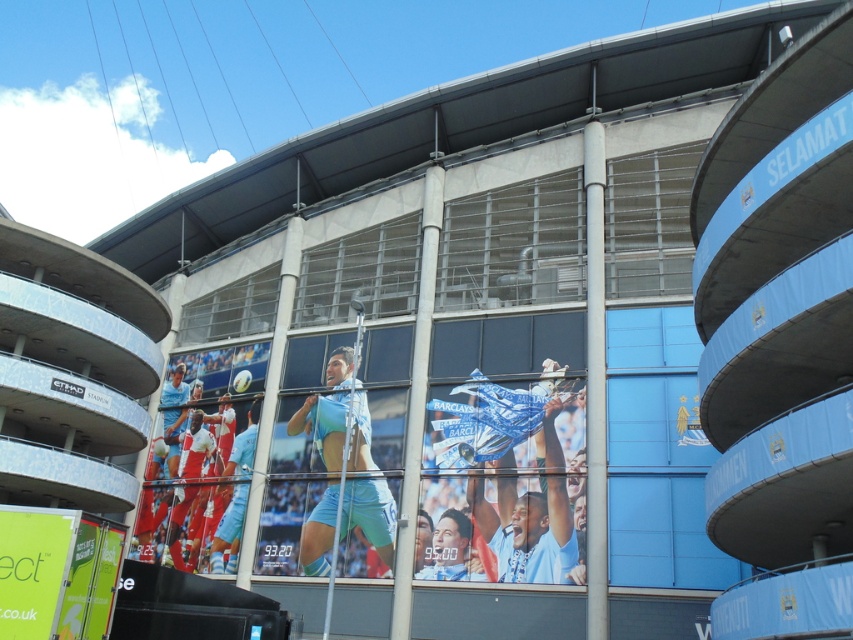
Question: Which of the following is the farthest from the observer?

Choices:
 (A) blue fabric banner at center
 (B) light blue fabric at center
 (C) matte blue jersey at center
 (D) red fabric soccer player at center

Answer: (D)

Question: Estimate the real-world distances between objects in this image. Which object is farther from the light blue fabric tennis match at center?

Choices:
 (A) blue fabric banner at center
 (B) red fabric soccer player at center
 (C) light blue jersey at center

Answer: (B)

Question: Is light blue jersey at center above matte blue jersey at center?

Choices:
 (A) yes
 (B) no

Answer: (A)

Question: Is light blue jersey at center to the right of matte blue jersey at center from the viewer's perspective?

Choices:
 (A) no
 (B) yes

Answer: (A)

Question: Which of the following is the closest to the observer?

Choices:
 (A) light blue jersey at center
 (B) blue fabric banner at center
 (C) red fabric soccer player at center
 (D) matte blue jersey at center

Answer: (B)

Question: Can you confirm if red fabric soccer player at center is positioned below matte blue jersey at center?

Choices:
 (A) yes
 (B) no

Answer: (B)